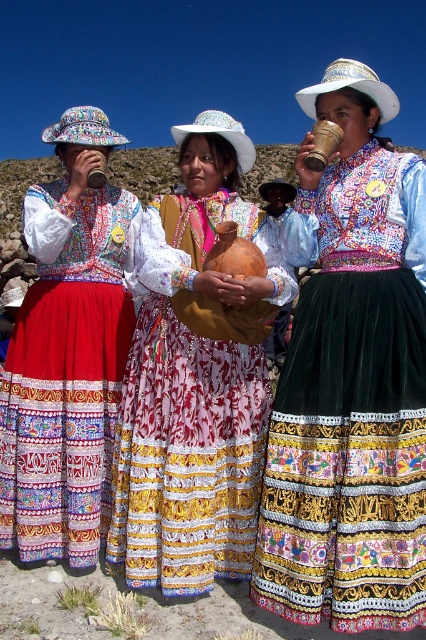
Question: Which object is the closest to the matte black cup at left?

Choices:
 (A) matte brown clay pot at center
 (B) matte brown clay cup at center

Answer: (A)

Question: Is matte brown clay cup at center positioned behind matte brown clay pot at center?

Choices:
 (A) yes
 (B) no

Answer: (B)

Question: Estimate the real-world distances between objects in this image. Which object is farther from the matte brown clay cup at center?

Choices:
 (A) matte black cup at left
 (B) matte brown clay pot at center

Answer: (A)

Question: Can you confirm if matte brown clay cup at center is positioned to the right of matte brown clay pot at center?

Choices:
 (A) yes
 (B) no

Answer: (A)

Question: Which is farther from the matte brown clay pot at center?

Choices:
 (A) matte brown clay cup at center
 (B) matte black cup at left

Answer: (A)

Question: Does matte brown clay cup at center have a greater width compared to matte black cup at left?

Choices:
 (A) no
 (B) yes

Answer: (A)